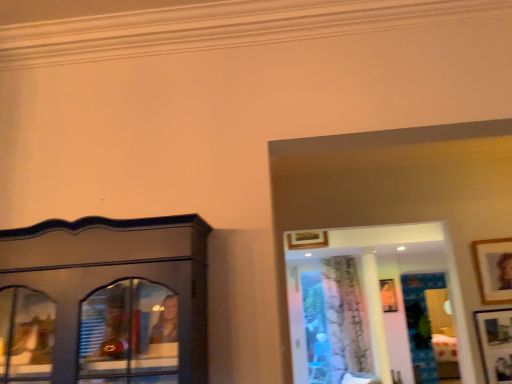
Question: From the image's perspective, is wooden picture frame at upper center, which appears as the second picture frame when viewed from the top, above or below white sheer curtain at center?

Choices:
 (A) above
 (B) below

Answer: (A)

Question: Is point (291, 238) positioned closer to the camera than point (355, 354)?

Choices:
 (A) closer
 (B) farther

Answer: (A)

Question: Estimate the real-world distances between objects in this image. Which object is farther from the wooden picture frame at upper center, which is counted as the fourth picture frame, starting from the right?

Choices:
 (A) wooden picture frame at lower right, arranged as the fourth picture frame when viewed from the back
 (B) white sheer curtain at center
 (C) matte wooden picture frame at center, arranged as the fourth picture frame when viewed from the top
 (D) wooden picture frame at upper right, marked as the first picture frame in a top-to-bottom arrangement

Answer: (C)

Question: Which object is the closest to the matte wooden picture frame at center, acting as the first picture frame starting from the bottom?

Choices:
 (A) wooden picture frame at upper center, which is counted as the fourth picture frame, starting from the right
 (B) wooden picture frame at upper right, arranged as the second picture frame when viewed from the front
 (C) white sheer curtain at center
 (D) wooden picture frame at lower right, placed as the second picture frame when sorted from bottom to top

Answer: (C)